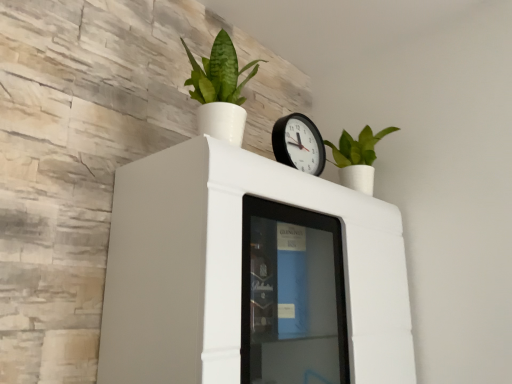
Question: Is green matte plant at upper center, marked as the 1th houseplant in a left-to-right arrangement, with white glossy cabinet at upper center?

Choices:
 (A) yes
 (B) no

Answer: (B)

Question: Considering the relative sizes of green matte plant at upper center, marked as the 1th houseplant in a left-to-right arrangement, and white glossy cabinet at upper center in the image provided, is green matte plant at upper center, marked as the 1th houseplant in a left-to-right arrangement, smaller than white glossy cabinet at upper center?

Choices:
 (A) no
 (B) yes

Answer: (B)

Question: Is green matte plant at upper center, marked as the first houseplant in a front-to-back arrangement, to the left of white glossy cabinet at upper center from the viewer's perspective?

Choices:
 (A) no
 (B) yes

Answer: (B)

Question: Does green matte plant at upper center, marked as the 1th houseplant in a left-to-right arrangement, have a larger size compared to white glossy cabinet at upper center?

Choices:
 (A) yes
 (B) no

Answer: (B)

Question: Does green matte plant at upper center, marked as the 1th houseplant in a left-to-right arrangement, lie in front of white glossy cabinet at upper center?

Choices:
 (A) yes
 (B) no

Answer: (B)

Question: Is green matte plant at upper right, which is the first houseplant in right-to-left order, wider or thinner than black plastic wall clock at upper center?

Choices:
 (A) thin
 (B) wide

Answer: (B)

Question: From their relative heights in the image, would you say green matte plant at upper right, which is the first houseplant in right-to-left order, is taller or shorter than black plastic wall clock at upper center?

Choices:
 (A) short
 (B) tall

Answer: (B)

Question: Would you say green matte plant at upper right, positioned as the second houseplant in front-to-back order, is to the left or to the right of black plastic wall clock at upper center in the picture?

Choices:
 (A) left
 (B) right

Answer: (B)

Question: Is point (366, 190) closer or farther from the camera than point (304, 132)?

Choices:
 (A) farther
 (B) closer

Answer: (A)

Question: Is green matte plant at upper center, placed as the 2th houseplant when sorted from right to left, taller or shorter than black plastic wall clock at upper center?

Choices:
 (A) tall
 (B) short

Answer: (A)

Question: From a real-world perspective, is green matte plant at upper center, which ranks as the second houseplant in back-to-front order, physically located above or below black plastic wall clock at upper center?

Choices:
 (A) above
 (B) below

Answer: (A)

Question: Is point (208, 114) closer or farther from the camera than point (276, 122)?

Choices:
 (A) closer
 (B) farther

Answer: (A)

Question: Visually, is green matte plant at upper center, marked as the first houseplant in a front-to-back arrangement, positioned to the left or to the right of black plastic wall clock at upper center?

Choices:
 (A) right
 (B) left

Answer: (B)

Question: In terms of width, does white glossy cabinet at upper center look wider or thinner when compared to green matte plant at upper right, which is the first houseplant in right-to-left order?

Choices:
 (A) wide
 (B) thin

Answer: (A)

Question: From the image's perspective, is white glossy cabinet at upper center above or below green matte plant at upper right, positioned as the second houseplant in front-to-back order?

Choices:
 (A) below
 (B) above

Answer: (A)